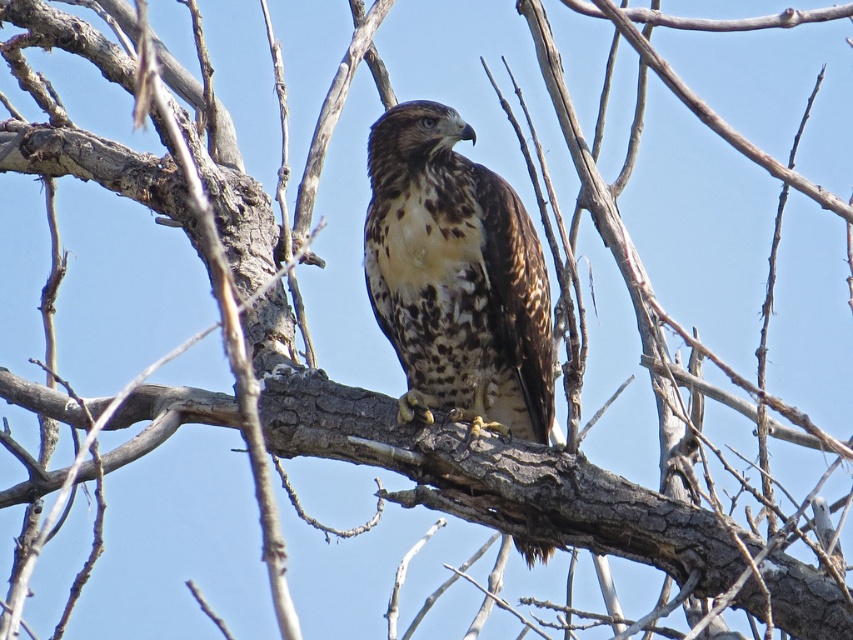
You are an ornithologist observing a bird perched on a branch. You notice two birds labeled as brown speckled eagle at center and brown speckled hawk at center. Which bird has a greater width?

The brown speckled eagle at center has a greater width than the brown speckled hawk at center.

You are observing a hawk perched on a branch in a clear blue sky. From your viewpoint, there are two points marked in the image. The first point is at coordinates point (x=419, y=253) and the second is at point (x=824, y=512). Which of these points is closer to you?

Point (x=824, y=512) is closer to you because point (x=419, y=253) is behind it.